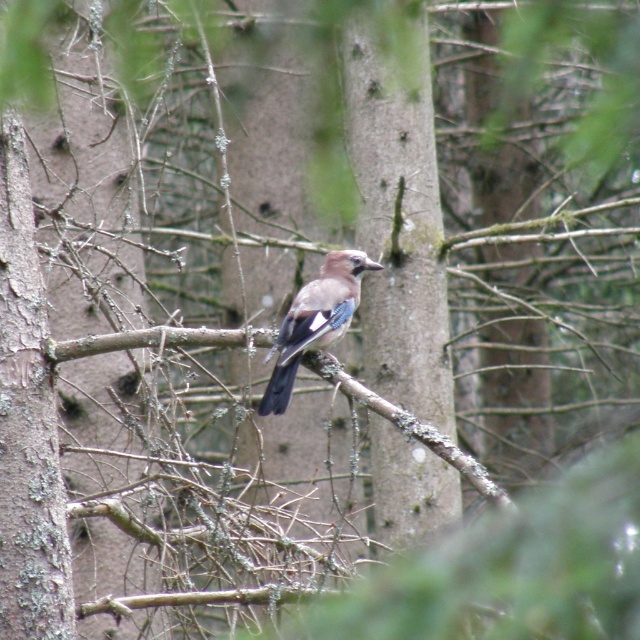
You are a hiker lost in the forest and see a bird on a branch. You notice a point marked at coordinates (397, 212). What does this point indicate in the scene?

The point at coordinates (397, 212) marks the brown rough tree trunk at center.

You are a hiker trying to navigate through the forest. You see two points marked in the image. Which point is closer to you, point (397, 86) or point (300, 298)?

Point (300, 298) is closer to you because point (397, 86) is behind it.